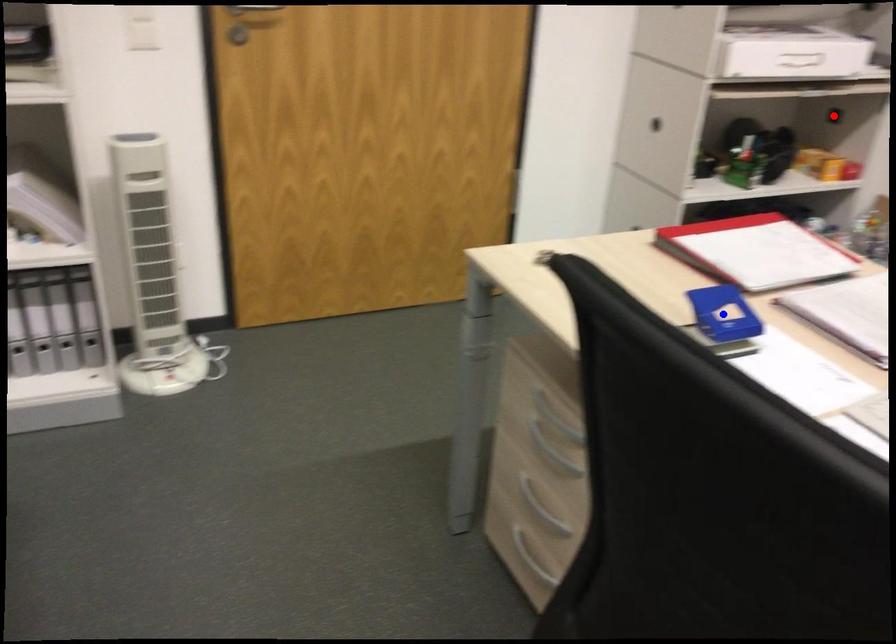
Question: In the image, two points are highlighted. Which point is nearer to the camera? Reply with the corresponding letter.

Choices:
 (A) blue point
 (B) red point

Answer: (A)